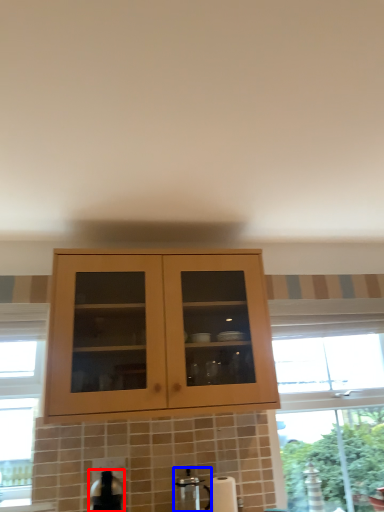
Question: Which of the following is the farthest to the observer, appliance (highlighted by a red box) or coffee machine (highlighted by a blue box)?

Choices:
 (A) appliance
 (B) coffee machine

Answer: (B)